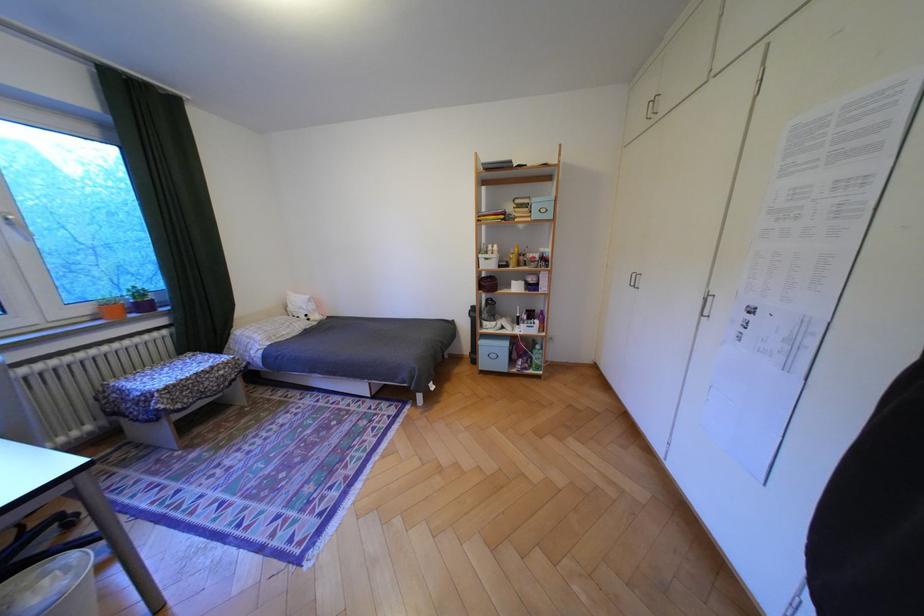
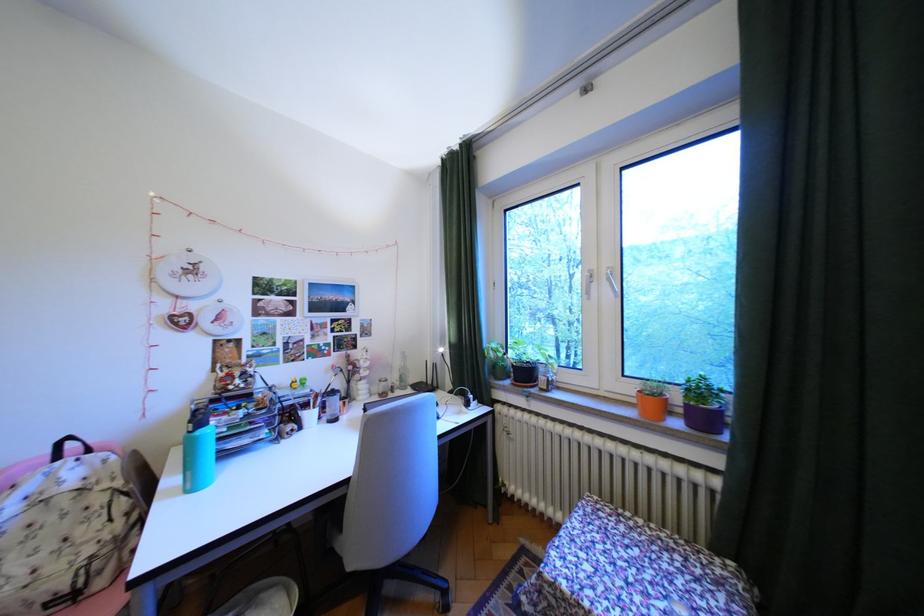
Find the pixel in the second image that matches (x=99, y=310) in the first image.

(641, 390)